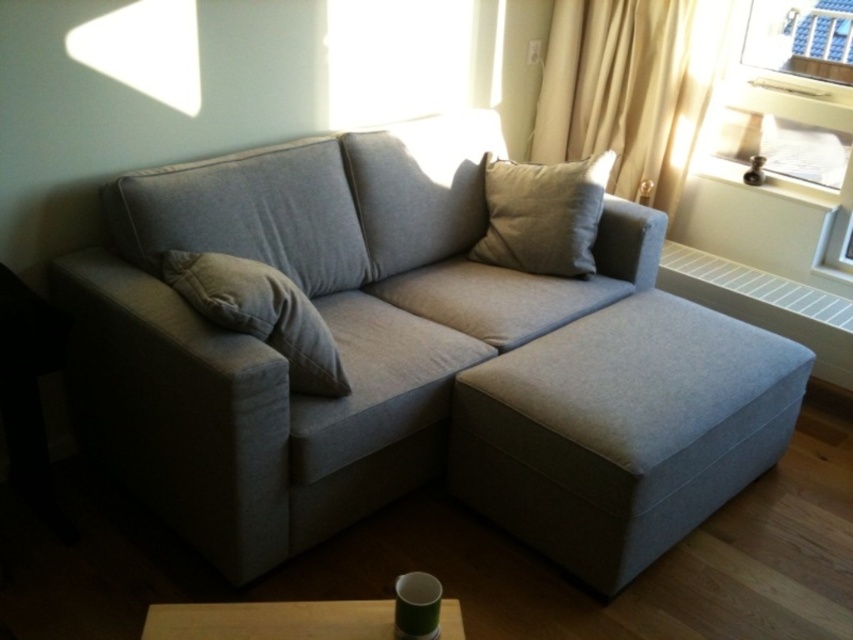
You are arranging a photo shoot in the living room and need to place two pillows for a cozy look. The scene has a light beige fabric pillow at upper right and a beige fabric pillow at center. Which pillow should you choose if you want the taller one for the shot?

The light beige fabric pillow at upper right is taller than the beige fabric pillow at center, so you should choose the light beige fabric pillow at upper right for the taller option.

You are a guest in the living room and want to know if the beige fabric curtain at upper right can cover the entire height of the clear glass window at upper right. Based on the scene, can it?

The beige fabric curtain at upper right is much taller than the clear glass window at upper right, so yes, it can cover the entire height of the clear glass window at upper right.

You are standing in the living room and want to know which of the two points, point (640, 61) or point (833, 48), is closer to you. Which one is nearer?

Point (640, 61) is further to the camera than point (833, 48), so the point closer to you is point (833, 48).